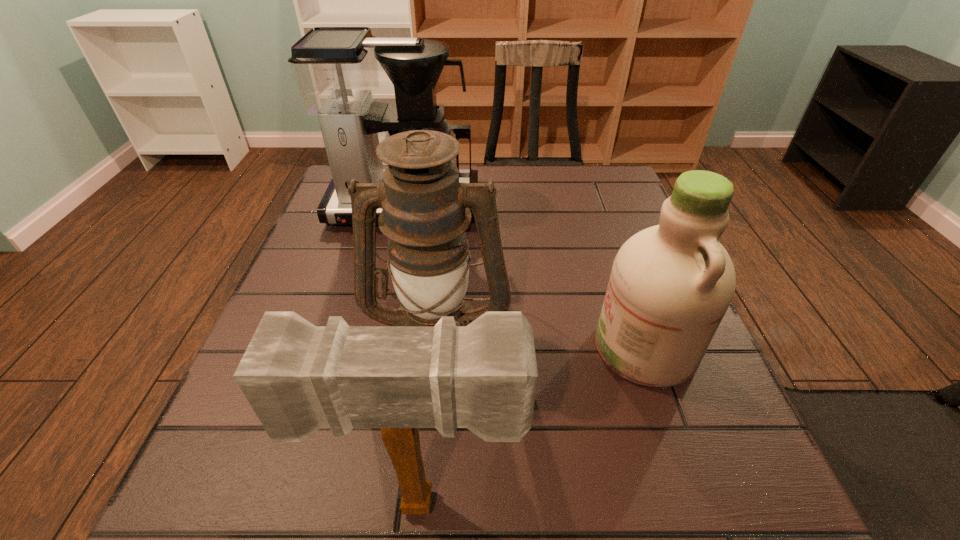
Locate an element on the screen. This screenshot has height=540, width=960. the farthest object is located at coordinates (335, 69).

Identify the location of oil lamp. (425, 212).

Identify the location of cleansing agent. The image size is (960, 540). (670, 286).

Locate an element on the screen. The width and height of the screenshot is (960, 540). mallet is located at coordinates (298, 377).

At what (x,y) coordinates should I click in order to perform the action: click on vacant area located 0.120m at the front of the coffee maker where the controls are located. Please return your answer as a coordinate pair (x, y). Looking at the image, I should click on (391, 268).

Locate an element on the screen. Image resolution: width=960 pixels, height=540 pixels. vacant space located on the right of the oil lamp is located at coordinates (618, 338).

Locate an element on the screen. free location located on the front label of the rightmost object is located at coordinates (471, 348).

Identify the location of vacant space located 0.310m on the front label of the rightmost object. This screenshot has width=960, height=540. (420, 348).

Locate an element on the screen. This screenshot has height=540, width=960. vacant region located on the front label of the rightmost object is located at coordinates (454, 348).

Find the location of `vacant area situated 0.120m on the left of the mallet`. vacant area situated 0.120m on the left of the mallet is located at coordinates (239, 503).